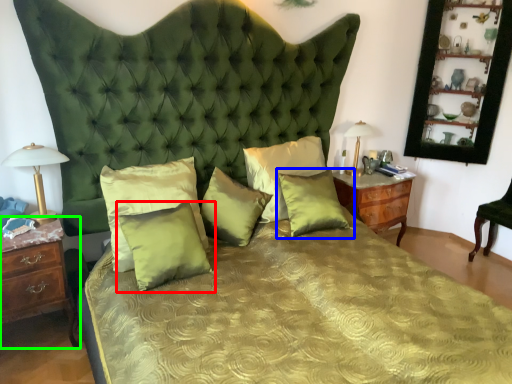
Question: Estimate the real-world distances between objects in this image. Which object is farther from pillow (highlighted by a red box), pillow (highlighted by a blue box) or nightstand (highlighted by a green box)?

Choices:
 (A) pillow
 (B) nightstand

Answer: (A)